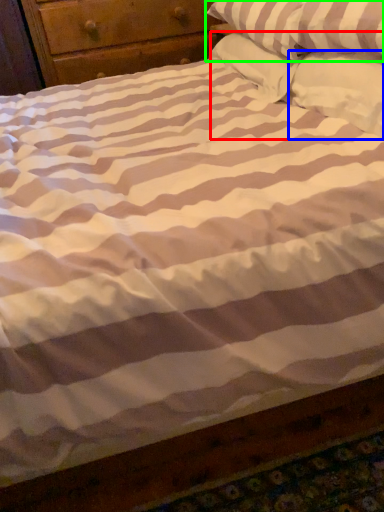
Question: Which object is positioned closest to pillow (highlighted by a red box)? Select from pillow (highlighted by a blue box) and pillow (highlighted by a green box).

Choices:
 (A) pillow
 (B) pillow

Answer: (A)